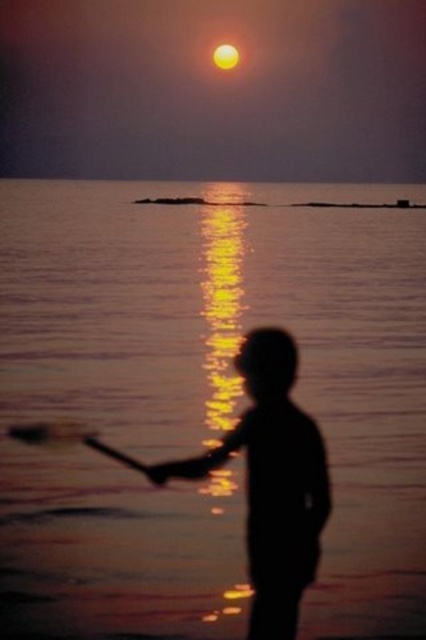
Find the location of a particular element. smooth water at center is located at coordinates (204, 400).

Between smooth water at center and silhouette figure at center, which one is positioned lower?

silhouette figure at center is below.

I want to click on smooth water at center, so click(204, 400).